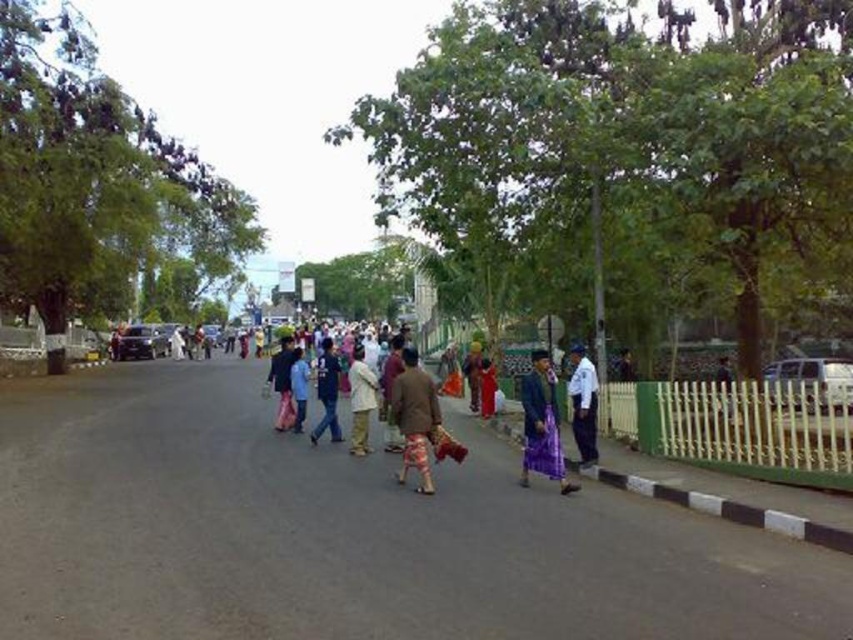
Which is above, brown woven cloth at center or purple woven skirt at center?

Positioned higher is brown woven cloth at center.

Does brown woven cloth at center appear under purple woven skirt at center?

No, brown woven cloth at center is not below purple woven skirt at center.

Is point (405, 445) closer to viewer compared to point (553, 394)?

No, it is not.

Identify the location of brown woven cloth at center. The width and height of the screenshot is (853, 640). (415, 419).

Can you confirm if brown woven cloth at center is positioned above blue fabric shirt at center?

No, brown woven cloth at center is not above blue fabric shirt at center.

Who is higher up, brown woven cloth at center or blue fabric shirt at center?

Positioned higher is blue fabric shirt at center.

Describe the element at coordinates (415, 419) in the screenshot. I see `brown woven cloth at center` at that location.

You are a GUI agent. You are given a task and a screenshot of the screen. Output one action in this format:
    pyautogui.click(x=<x>, y=<y>)
    Task: Click on the brown woven cloth at center
    This screenshot has height=640, width=853.
    Given the screenshot: What is the action you would take?
    pyautogui.click(x=415, y=419)

Identify the location of purple woven skirt at center. Image resolution: width=853 pixels, height=640 pixels. (541, 424).

Does purple woven skirt at center appear on the right side of blue fabric shirt at center?

Indeed, purple woven skirt at center is positioned on the right side of blue fabric shirt at center.

Does point (525, 406) come in front of point (329, 428)?

Yes, point (525, 406) is in front of point (329, 428).

Where is `purple woven skirt at center`? This screenshot has width=853, height=640. purple woven skirt at center is located at coordinates (541, 424).